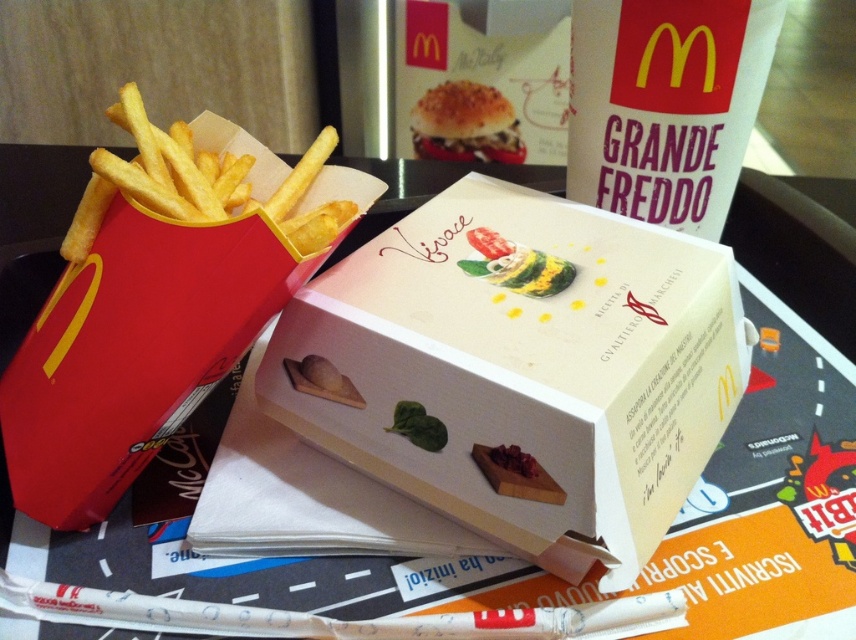
You are at a McDonalds and see the items on the table. Which object is located at the coordinates point (131, 353)?

The matte cardboard box at left is located at point (131, 353).